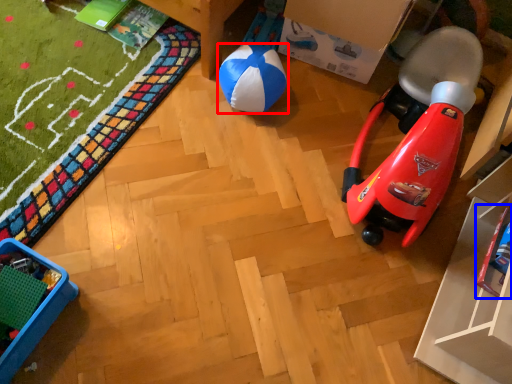
Question: Which point is further to the camera, ball (highlighted by a red box) or toy (highlighted by a blue box)?

Choices:
 (A) ball
 (B) toy

Answer: (A)